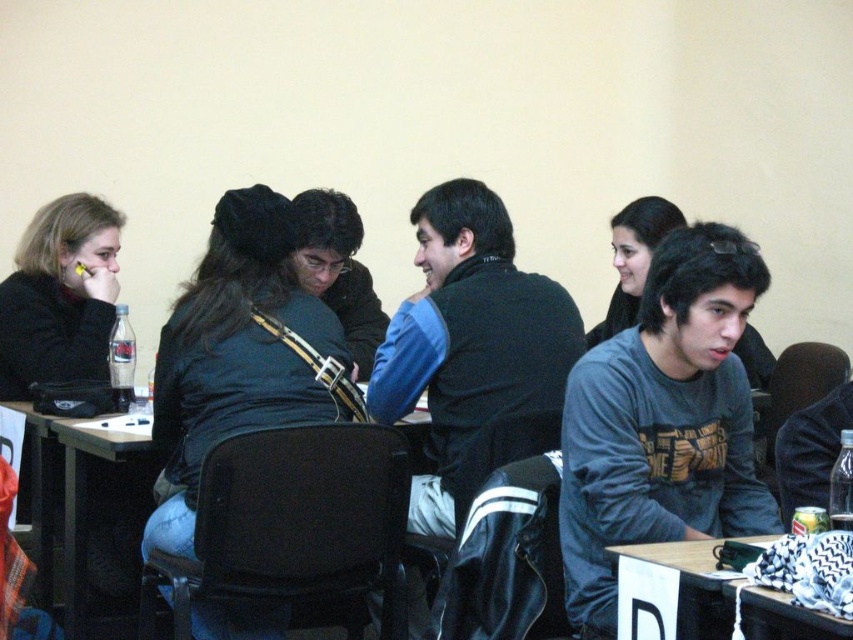
Question: Which of these objects is positioned closest to the black plastic table at center?

Choices:
 (A) dark green sweater at center
 (B) gray cotton shirt at center

Answer: (A)

Question: Which point is farther to the camera?

Choices:
 (A) (236, 401)
 (B) (718, 636)
 (C) (45, 492)
 (D) (598, 404)

Answer: (C)

Question: Does gray cotton shirt at center have a greater width compared to dark green sweater at center?

Choices:
 (A) no
 (B) yes

Answer: (A)

Question: Is gray cotton shirt at center bigger than black plastic table at center?

Choices:
 (A) no
 (B) yes

Answer: (A)

Question: Is wooden table at lower right below black plastic table at center?

Choices:
 (A) yes
 (B) no

Answer: (A)

Question: Which object is positioned closest to the black plastic table at center?

Choices:
 (A) dark green sweater at center
 (B) gray cotton shirt at center
 (C) wooden table at lower right

Answer: (A)